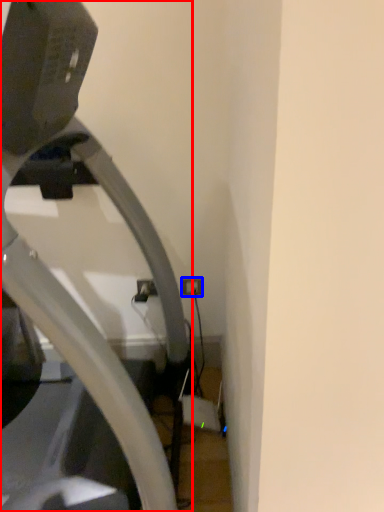
Question: Among these objects, which one is nearest to the camera, treadmill (highlighted by a red box) or electric outlet (highlighted by a blue box)?

Choices:
 (A) treadmill
 (B) electric outlet

Answer: (A)